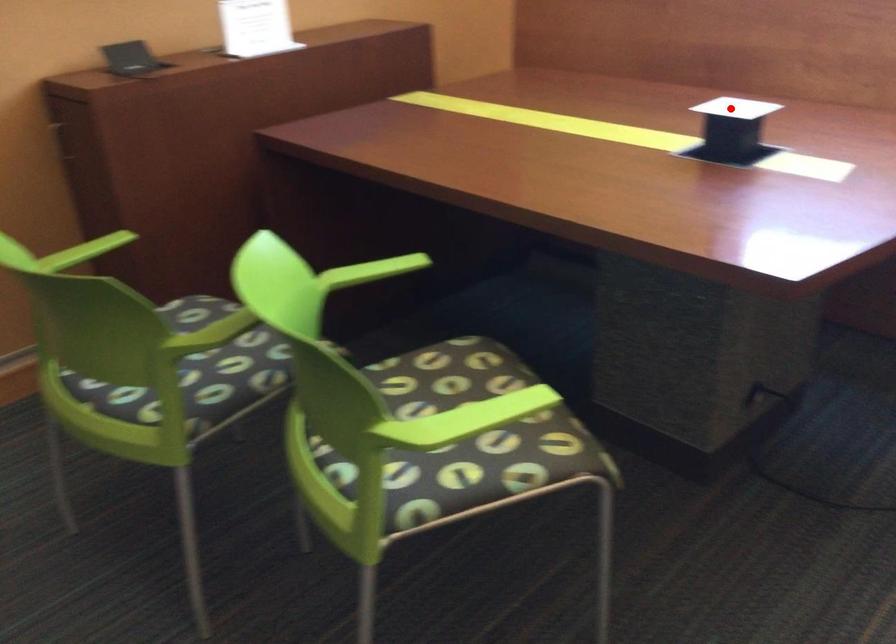
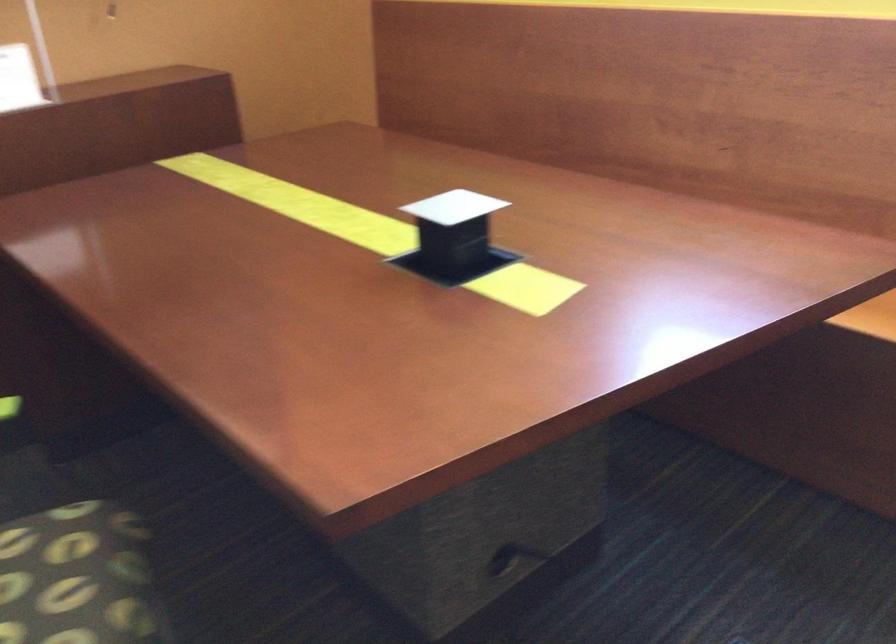
Question: I am providing you with two images of the same scene from different viewpoints. Given a red point in image1, look at the same physical point in image2. Is it:

Choices:
 (A) Closer to the viewpoint
 (B) Farther from the viewpoint

Answer: (A)